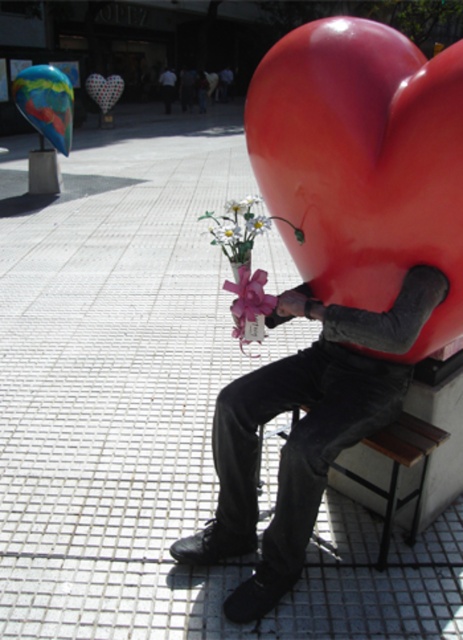
Can you confirm if glossy plastic heart at right is wider than black matte pants at lower center?

Correct, the width of glossy plastic heart at right exceeds that of black matte pants at lower center.

Identify the location of glossy plastic heart at right. This screenshot has width=463, height=640. (363, 163).

Between glossy plastic heart at right and pink silk flower at center, which one appears on the right side from the viewer's perspective?

glossy plastic heart at right is more to the right.

In the scene shown: Who is more distant from viewer, (292, 108) or (243, 323)?

Positioned behind is point (243, 323).

Image resolution: width=463 pixels, height=640 pixels. What are the coordinates of `glossy plastic heart at right` in the screenshot? It's located at (363, 163).

Identify the location of glossy plastic heart at right. This screenshot has height=640, width=463. (363, 163).

Does glossy plastic heart at right have a larger size compared to white matte flower at center?

Yes.

How distant is glossy plastic heart at right from white matte flower at center?

glossy plastic heart at right and white matte flower at center are 11.97 inches apart.

Measure the distance between point (440, 138) and camera.

1.66 meters

You are a GUI agent. You are given a task and a screenshot of the screen. Output one action in this format:
    pyautogui.click(x=<x>, y=<y>)
    Task: Click on the glossy plastic heart at right
    The image size is (463, 640).
    Given the screenshot: What is the action you would take?
    pyautogui.click(x=363, y=163)